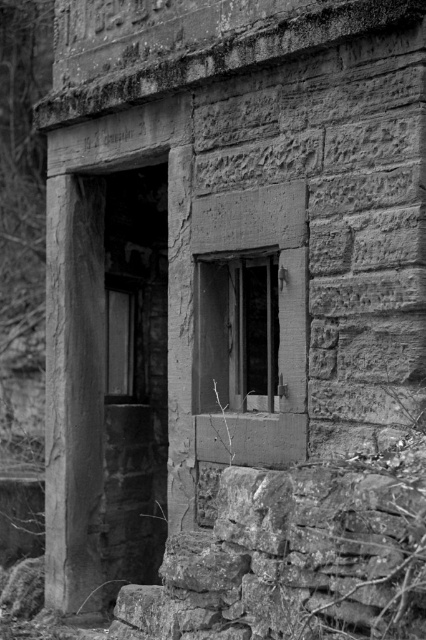
Question: Does wooden frame at center come behind smooth glass window at center?

Choices:
 (A) no
 (B) yes

Answer: (A)

Question: Can you confirm if wooden frame at center is positioned to the right of smooth glass window at center?

Choices:
 (A) no
 (B) yes

Answer: (B)

Question: Is wooden frame at center further to the viewer compared to smooth glass window at center?

Choices:
 (A) yes
 (B) no

Answer: (B)

Question: Which point is closer to the camera taking this photo?

Choices:
 (A) (108, 353)
 (B) (253, 401)

Answer: (B)